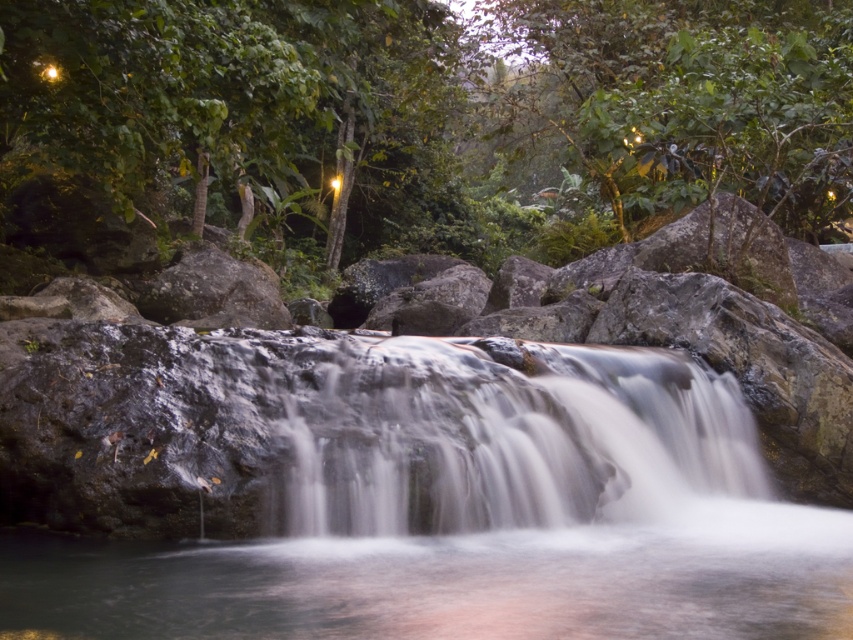
Question: Estimate the real-world distances between objects in this image. Which object is farther from the smooth rock waterfall at center?

Choices:
 (A) clear water at center
 (B) smooth white water at center

Answer: (A)

Question: Among these points, which one is farthest from the camera?

Choices:
 (A) (450, 371)
 (B) (524, 634)
 (C) (596, 545)

Answer: (A)

Question: Which of the following is the farthest from the observer?

Choices:
 (A) (612, 428)
 (B) (1, 636)
 (C) (374, 365)

Answer: (A)

Question: Is smooth rock waterfall at center smaller than clear water at center?

Choices:
 (A) no
 (B) yes

Answer: (A)

Question: Does smooth rock waterfall at center have a larger size compared to smooth white water at center?

Choices:
 (A) no
 (B) yes

Answer: (B)

Question: Does clear water at center come in front of smooth white water at center?

Choices:
 (A) yes
 (B) no

Answer: (A)